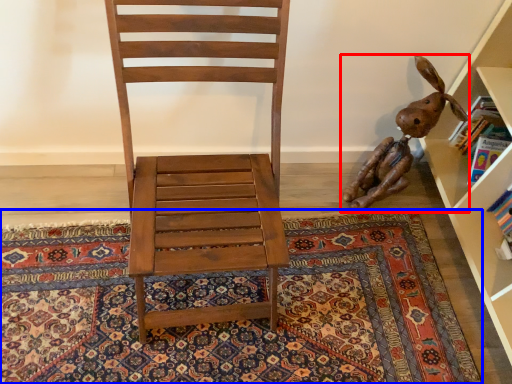
Question: Which object appears farthest to the camera in this image, toy (highlighted by a red box) or mat (highlighted by a blue box)?

Choices:
 (A) toy
 (B) mat

Answer: (A)